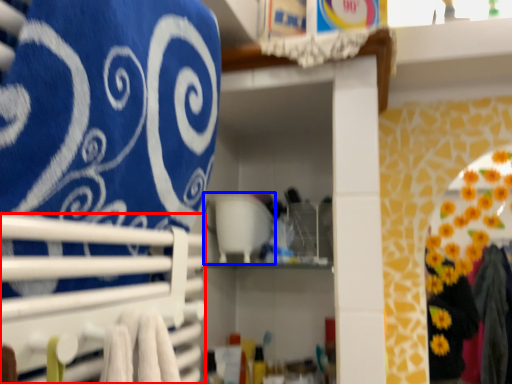
Question: Which object appears farthest to the camera in this image, closet (highlighted by a red box) or appliance (highlighted by a blue box)?

Choices:
 (A) closet
 (B) appliance

Answer: (B)